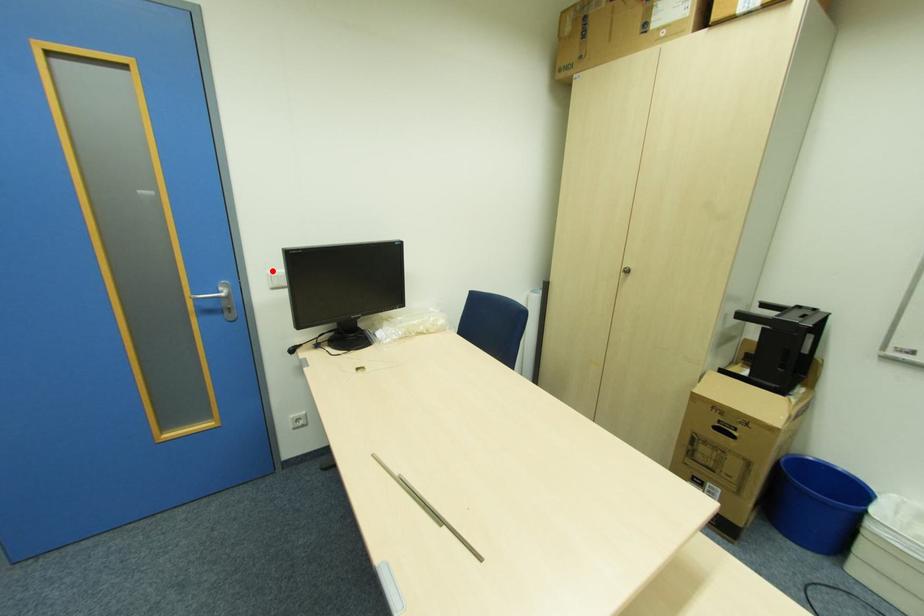
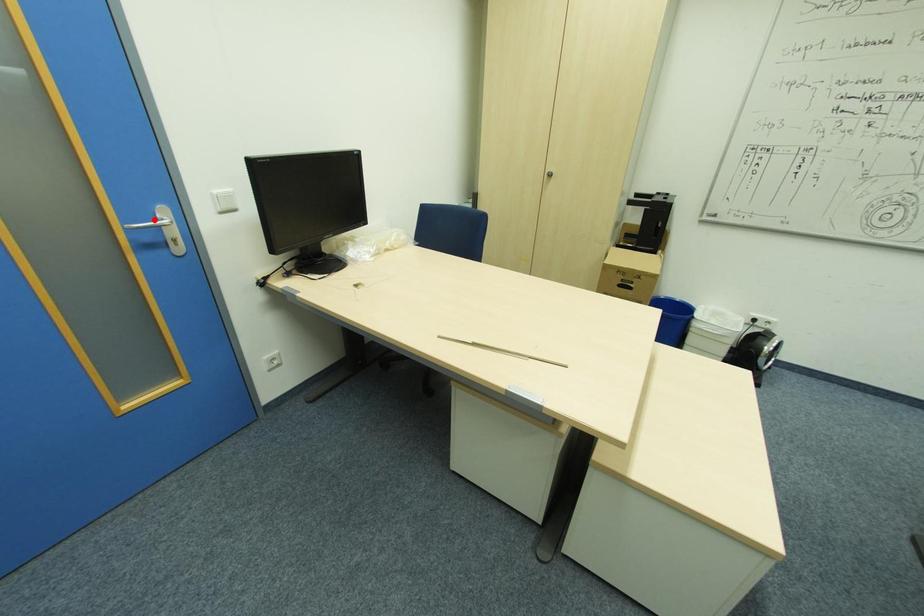
I am providing you with two images of the same scene from different viewpoints. A red point is marked on the first image and another point is marked on the second image. Does the point marked in image1 correspond to the same location as the one in image2?

No